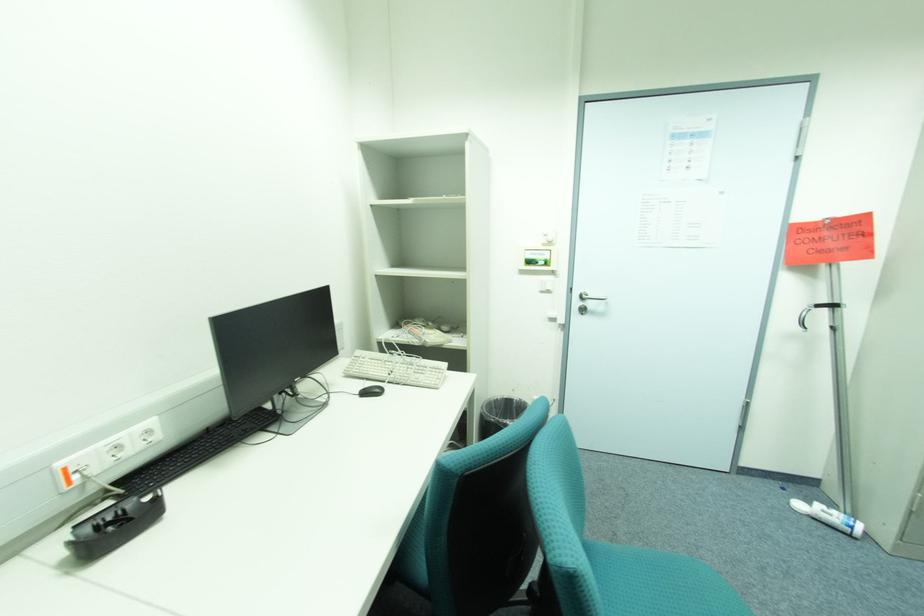
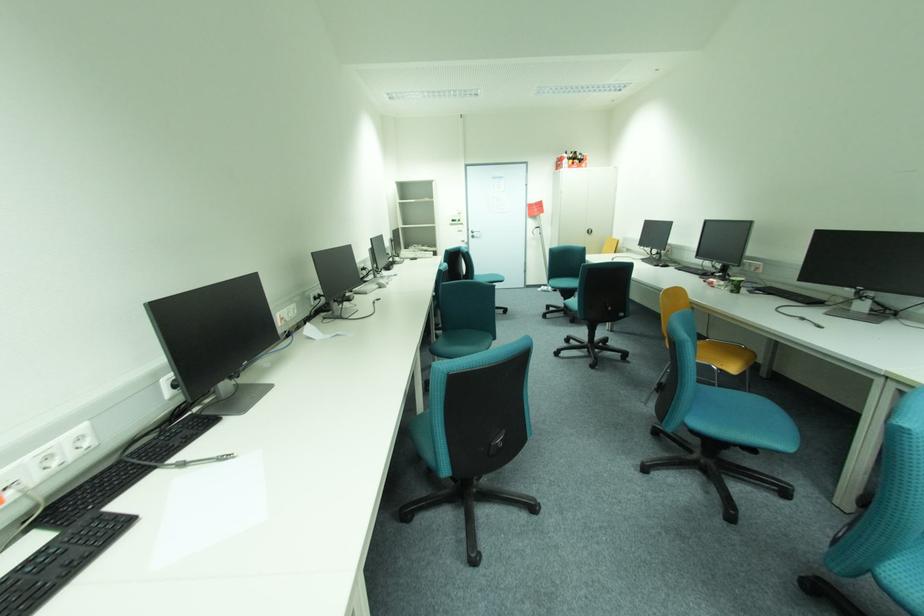
Question: In a continuous first-person perspective shot, in which direction is the camera moving?

Choices:
 (A) Left
 (B) Right
 (C) Forward
 (D) Backward

Answer: (D)